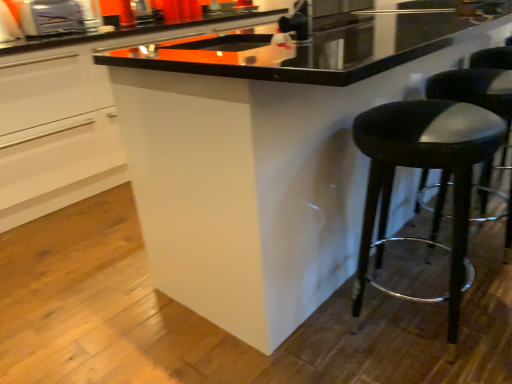
Question: From the image's perspective, is black leather stool at lower right on metallic silver toaster at upper left?

Choices:
 (A) yes
 (B) no

Answer: (B)

Question: Does black leather stool at lower right contain metallic silver toaster at upper left?

Choices:
 (A) yes
 (B) no

Answer: (B)

Question: Considering the relative sizes of black leather stool at lower right and metallic silver toaster at upper left in the image provided, is black leather stool at lower right thinner than metallic silver toaster at upper left?

Choices:
 (A) yes
 (B) no

Answer: (B)

Question: Is black leather stool at lower right turned away from metallic silver toaster at upper left?

Choices:
 (A) no
 (B) yes

Answer: (A)

Question: Does black leather stool at lower right have a greater height compared to metallic silver toaster at upper left?

Choices:
 (A) no
 (B) yes

Answer: (B)

Question: In terms of size, does black leather stool at lower right appear bigger or smaller than black leather stool at right?

Choices:
 (A) big
 (B) small

Answer: (B)

Question: Is point (373, 135) closer or farther from the camera than point (501, 114)?

Choices:
 (A) farther
 (B) closer

Answer: (B)

Question: Is black leather stool at lower right taller or shorter than black leather stool at right?

Choices:
 (A) short
 (B) tall

Answer: (A)

Question: From the image's perspective, is black leather stool at lower right above or below black leather stool at right?

Choices:
 (A) above
 (B) below

Answer: (B)

Question: Is point click(x=70, y=9) positioned closer to the camera than point click(x=258, y=16)?

Choices:
 (A) closer
 (B) farther

Answer: (B)

Question: Is metallic silver toaster at upper left inside the boundaries of white glossy cabinet at center, or outside?

Choices:
 (A) inside
 (B) outside

Answer: (A)

Question: From the image's perspective, is metallic silver toaster at upper left above or below white glossy cabinet at center?

Choices:
 (A) above
 (B) below

Answer: (B)

Question: In the image, is metallic silver toaster at upper left positioned in front of or behind white glossy cabinet at center?

Choices:
 (A) front
 (B) behind

Answer: (B)

Question: Relative to black leather stool at lower right, is black leather stool at right in front or behind?

Choices:
 (A) behind
 (B) front

Answer: (A)

Question: Is point (484, 96) positioned closer to the camera than point (453, 114)?

Choices:
 (A) closer
 (B) farther

Answer: (B)